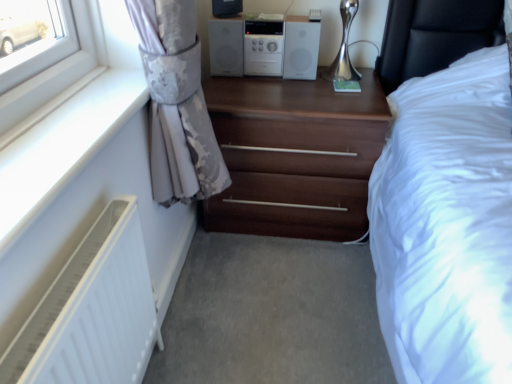
Where is `vacant space in silky gray curtain at left (from a real-world perspective)`? The width and height of the screenshot is (512, 384). vacant space in silky gray curtain at left (from a real-world perspective) is located at coordinates (200, 291).